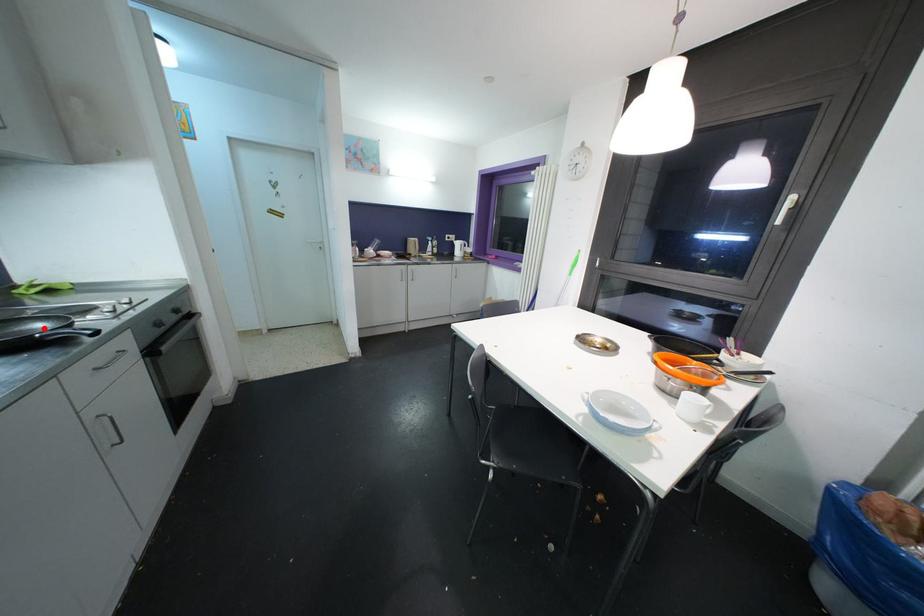
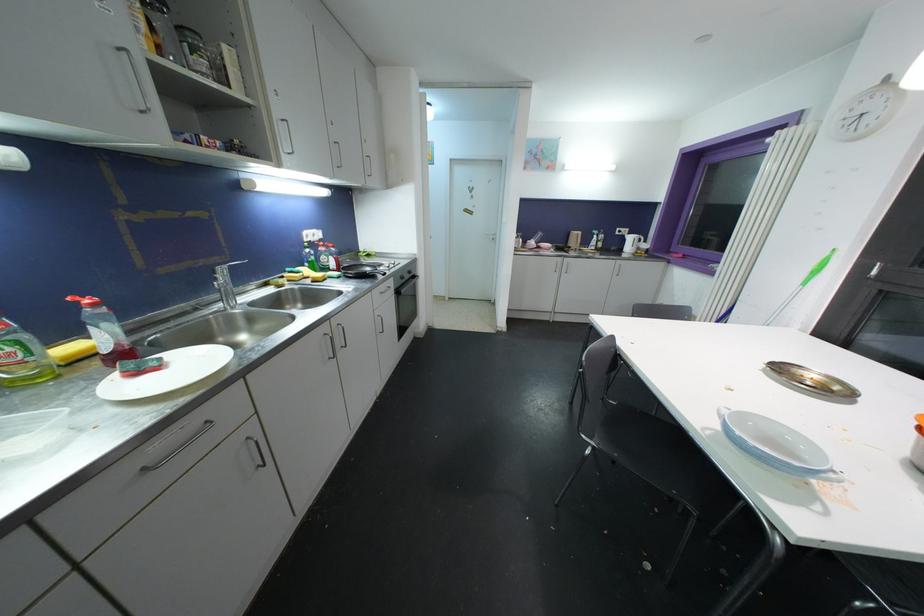
Find the pixel in the second image that matches the highlighted location in the first image.

(371, 272)